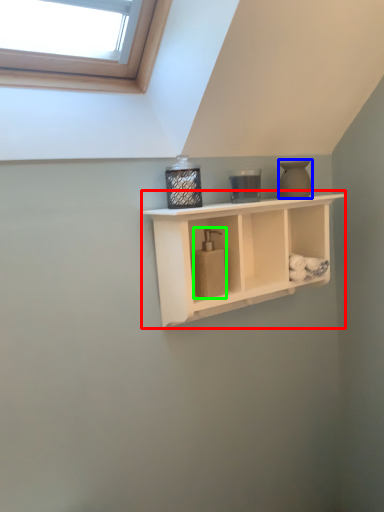
Question: Which object is the farthest from shelf (highlighted by a red box)? Choose among these: vase (highlighted by a blue box) or soap dispenser (highlighted by a green box).

Choices:
 (A) vase
 (B) soap dispenser

Answer: (A)